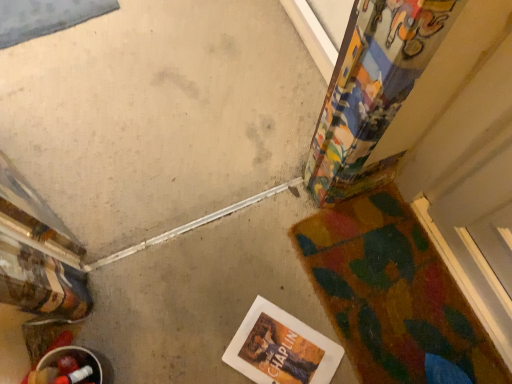
You are a GUI agent. You are given a task and a screenshot of the screen. Output one action in this format:
    pyautogui.click(x=<x>, y=<y>)
    Task: Click on the hardcover book at lower center
    This screenshot has width=512, height=384.
    Given the screenshot: What is the action you would take?
    pyautogui.click(x=281, y=348)

Image resolution: width=512 pixels, height=384 pixels. Describe the element at coordinates (281, 348) in the screenshot. I see `hardcover book at lower center` at that location.

Find the location of a particular element. The width and height of the screenshot is (512, 384). hardcover book at lower center is located at coordinates (281, 348).